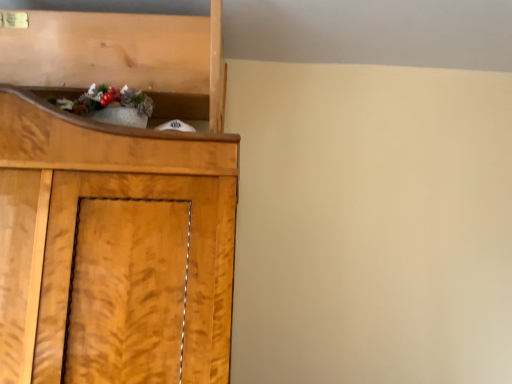
Question: Considering the positions of shiny metallic ornament at upper left and wooden shelf at upper left in the image, is shiny metallic ornament at upper left bigger or smaller than wooden shelf at upper left?

Choices:
 (A) big
 (B) small

Answer: (B)

Question: Is shiny metallic ornament at upper left taller or shorter than wooden shelf at upper left?

Choices:
 (A) tall
 (B) short

Answer: (B)

Question: Is shiny metallic ornament at upper left wider or thinner than wooden shelf at upper left?

Choices:
 (A) thin
 (B) wide

Answer: (A)

Question: Relative to shiny metallic ornament at upper left, is wooden shelf at upper left in front or behind?

Choices:
 (A) behind
 (B) front

Answer: (A)

Question: Visually, is wooden shelf at upper left positioned to the left or to the right of shiny metallic ornament at upper left?

Choices:
 (A) left
 (B) right

Answer: (A)

Question: From the image's perspective, is wooden shelf at upper left located above or below shiny metallic ornament at upper left?

Choices:
 (A) below
 (B) above

Answer: (B)

Question: From a real-world perspective, is wooden shelf at upper left positioned above or below shiny metallic ornament at upper left?

Choices:
 (A) below
 (B) above

Answer: (B)